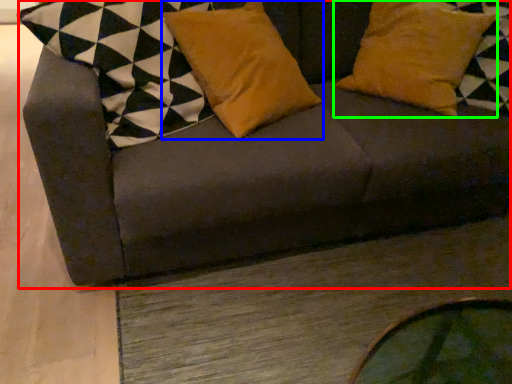
Question: Based on their relative distances, which object is nearer to studio couch (highlighted by a red box)? Choose from pillow (highlighted by a blue box) and pillow (highlighted by a green box).

Choices:
 (A) pillow
 (B) pillow

Answer: (A)